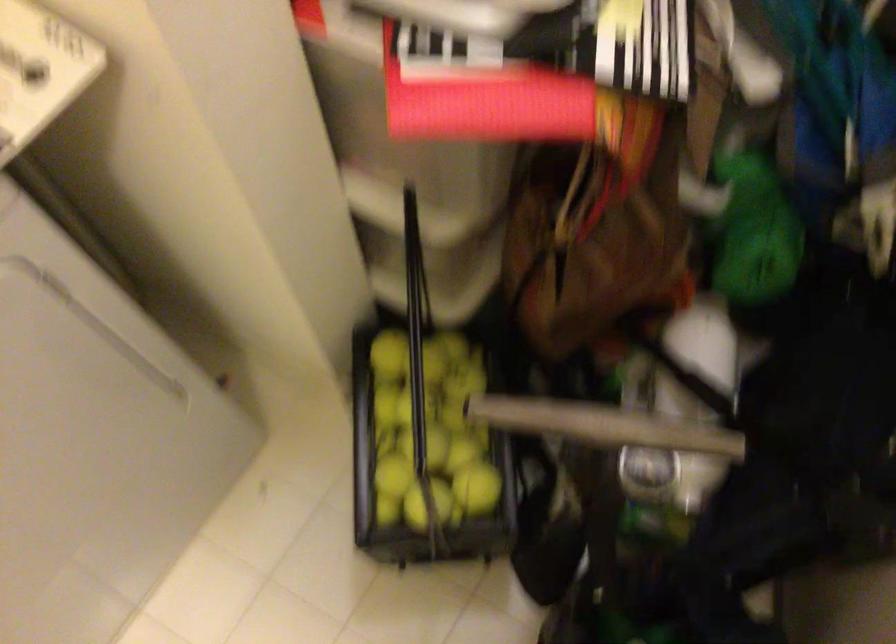
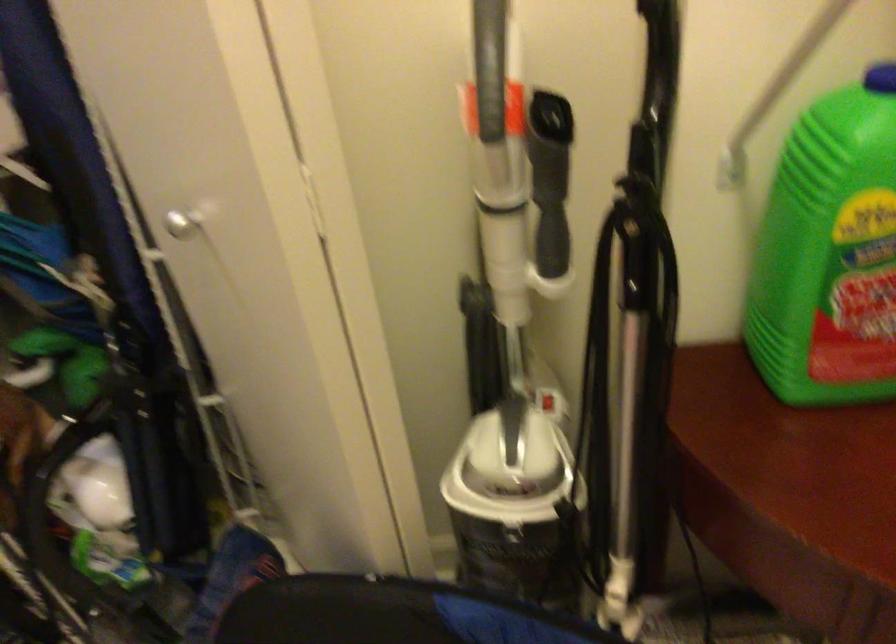
Question: The camera is either moving clockwise (left) or counter-clockwise (right) around the object. The first image is from the beginning of the video and the second image is from the end. Is the camera moving left or right when shooting the video?

Choices:
 (A) Left
 (B) Right

Answer: (A)